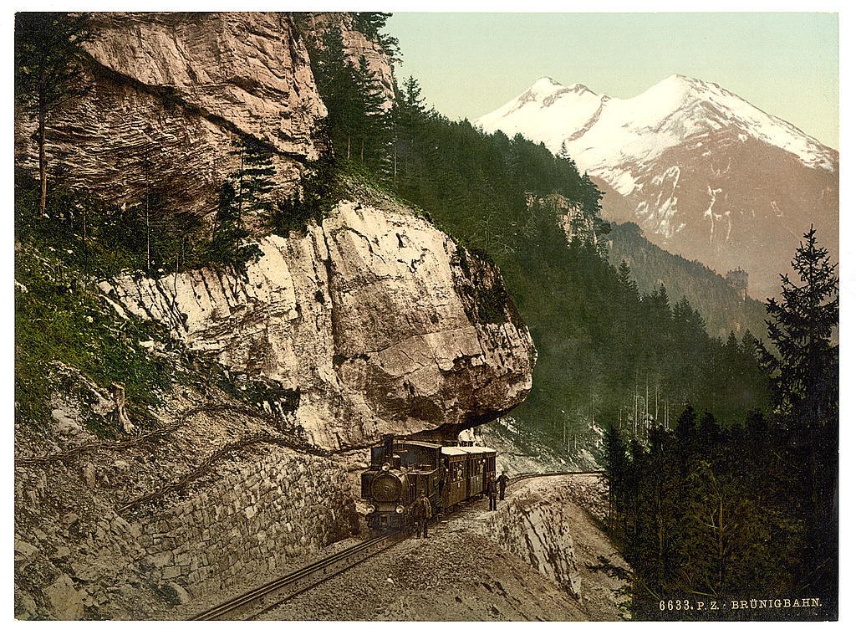
Question: Does black metal train at center appear over smooth metal train track at center?

Choices:
 (A) no
 (B) yes

Answer: (B)

Question: Which of the following is the closest to the observer?

Choices:
 (A) white snow-covered mountain at upper center
 (B) black metal train at center
 (C) smooth metal train track at center

Answer: (C)

Question: Among these points, which one is farthest from the camera?

Choices:
 (A) (328, 566)
 (B) (420, 436)
 (C) (629, 109)

Answer: (C)

Question: Which of the following is the closest to the observer?

Choices:
 (A) smooth metal train track at center
 (B) white snow-covered mountain at upper center

Answer: (A)

Question: Considering the relative positions of white snow-covered mountain at upper center and smooth metal train track at center in the image provided, where is white snow-covered mountain at upper center located with respect to smooth metal train track at center?

Choices:
 (A) left
 (B) right

Answer: (B)

Question: Is white snow-covered mountain at upper center wider than smooth metal train track at center?

Choices:
 (A) yes
 (B) no

Answer: (A)